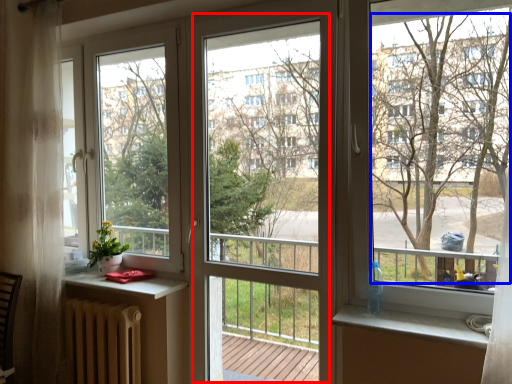
Question: Which point is closer to the camera, screen door (highlighted by a red box) or tree (highlighted by a blue box)?

Choices:
 (A) screen door
 (B) tree

Answer: (B)